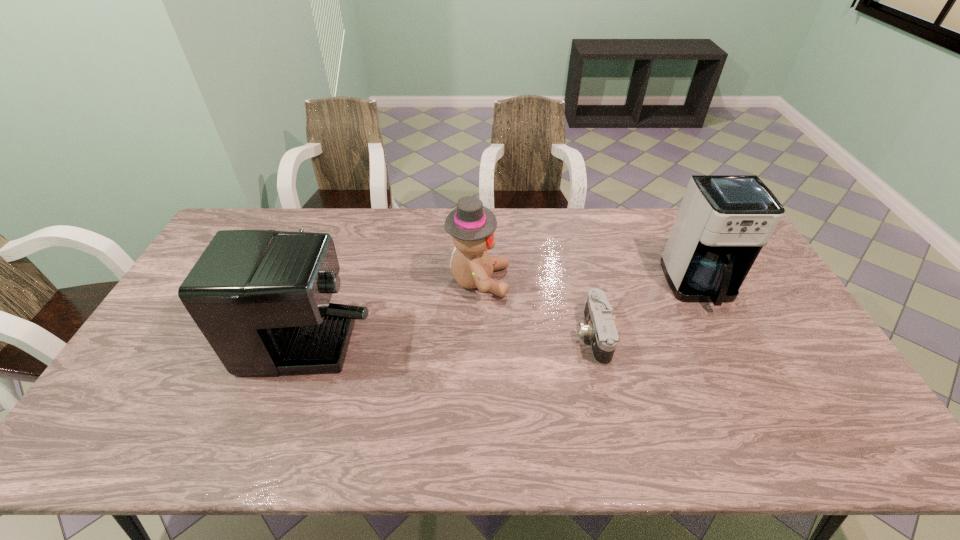
In order to click on vacant area that satisfies the following two spatial constraints: 1. on the front panel of the rightmost object; 2. on the front-facing side of the left coffee maker in this screenshot , I will do `click(706, 298)`.

At what (x,y) coordinates should I click in order to perform the action: click on blank area in the image that satisfies the following two spatial constraints: 1. on the front panel of the right coffee maker; 2. on the lens of the second object from right to left. Please return your answer as a coordinate pair (x, y). The height and width of the screenshot is (540, 960). Looking at the image, I should click on (724, 335).